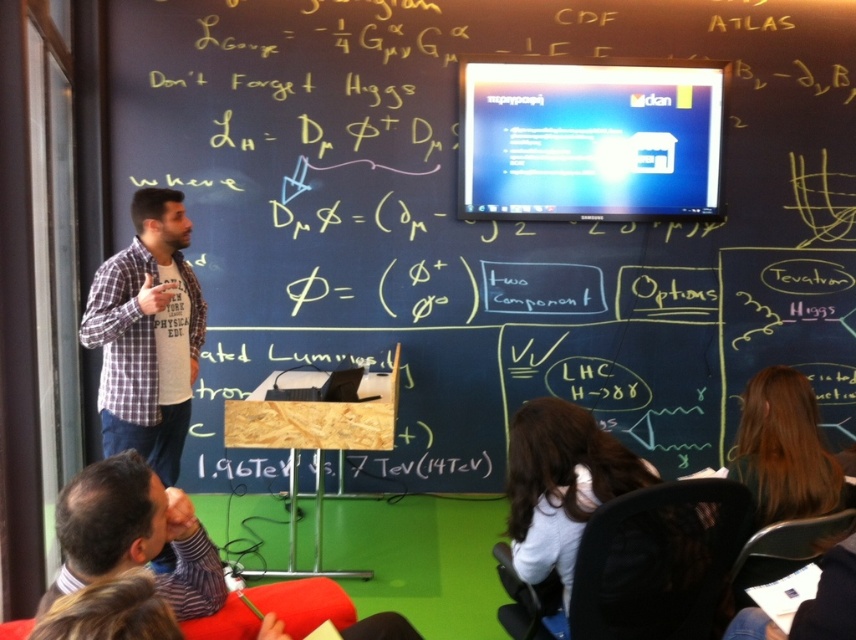
You are a student sitting in the classroom and want to know which shirt is narrower between the plaid shirt at left and the white fabric shirt at lower right. Which one is narrower?

The plaid shirt at left is narrower than the white fabric shirt at lower right because its width is less than the other shirt.

You are a student sitting in the classroom and need to hand in an assignment. You see the plaid shirt at left and the dark brown leather jacket at lower left. Which item is closer to you?

The dark brown leather jacket at lower left is behind the plaid shirt at left, so the plaid shirt at left is closer to you.

You are a student sitting in the classroom. You need to place your notebook on the wooden podium at center. Where exactly should you place it?

You should place your notebook at point [486,224] on the wooden podium at center.